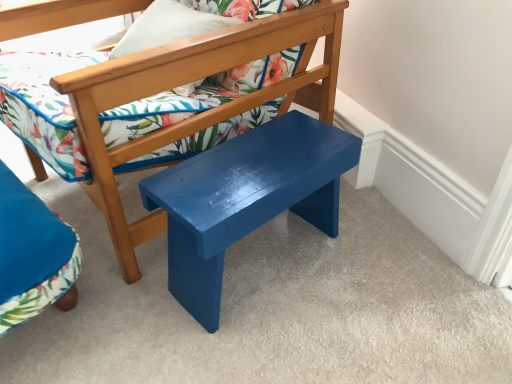
Question: Is velvet blue chair at lower left, which appears as the 1th chair when ordered from the bottom, shorter than glossy wood stool at center?

Choices:
 (A) yes
 (B) no

Answer: (A)

Question: From a real-world perspective, is velvet blue chair at lower left, placed as the 2th chair when sorted from top to bottom, physically above glossy wood stool at center?

Choices:
 (A) yes
 (B) no

Answer: (B)

Question: Is velvet blue chair at lower left, which appears as the 1th chair when ordered from the bottom, thinner than glossy wood stool at center?

Choices:
 (A) yes
 (B) no

Answer: (A)

Question: Is velvet blue chair at lower left, placed as the 2th chair when sorted from top to bottom, placed right next to glossy wood stool at center?

Choices:
 (A) no
 (B) yes

Answer: (A)

Question: Can you confirm if velvet blue chair at lower left, which appears as the 1th chair when ordered from the bottom, is positioned to the right of glossy wood stool at center?

Choices:
 (A) yes
 (B) no

Answer: (B)

Question: From a real-world perspective, is velvet blue chair at lower left, which appears as the 1th chair when ordered from the bottom, positioned under glossy wood stool at center based on gravity?

Choices:
 (A) no
 (B) yes

Answer: (B)

Question: Does matte floral pillow at upper center have a smaller size compared to glossy wood stool at center?

Choices:
 (A) yes
 (B) no

Answer: (A)

Question: Is matte floral pillow at upper center in front of glossy wood stool at center?

Choices:
 (A) yes
 (B) no

Answer: (B)

Question: From the image's perspective, is matte floral pillow at upper center under glossy wood stool at center?

Choices:
 (A) yes
 (B) no

Answer: (B)

Question: Does matte floral pillow at upper center have a greater width compared to glossy wood stool at center?

Choices:
 (A) yes
 (B) no

Answer: (B)

Question: From a real-world perspective, is matte floral pillow at upper center physically below glossy wood stool at center?

Choices:
 (A) no
 (B) yes

Answer: (A)

Question: Is glossy wood stool at center located within matte floral pillow at upper center?

Choices:
 (A) no
 (B) yes

Answer: (A)

Question: Is matte blue bench at center, arranged as the 2th chair when ordered from the bottom, facing away from matte floral pillow at upper center?

Choices:
 (A) yes
 (B) no

Answer: (A)